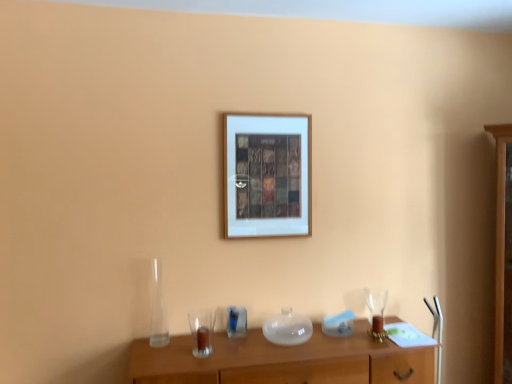
The height and width of the screenshot is (384, 512). What do you see at coordinates (376, 312) in the screenshot?
I see `clear glass wine glass at right` at bounding box center [376, 312].

Measure the distance between point (250, 200) and camera.

The depth of point (250, 200) is 2.47 meters.

Locate an element on the screen. Image resolution: width=512 pixels, height=384 pixels. wooden table at center is located at coordinates (284, 361).

Is clear glass wine glass at right far away from transparent glass vase at lower left?

Yes, clear glass wine glass at right and transparent glass vase at lower left are quite far apart.

From the image's perspective, is clear glass wine glass at right on transparent glass vase at lower left?

Actually, clear glass wine glass at right appears below transparent glass vase at lower left in the image.

Can you tell me how much clear glass wine glass at right and transparent glass vase at lower left differ in facing direction?

clear glass wine glass at right and transparent glass vase at lower left are facing 0.00132 degrees away from each other.

Which of these two, clear glass wine glass at right or transparent glass vase at lower left, is smaller?

With smaller size is clear glass wine glass at right.

The image size is (512, 384). I want to click on wine glass in front of the white matte picture frame at center, so click(376, 312).

Considering the relative sizes of white matte picture frame at center and clear glass wine glass at right in the image provided, is white matte picture frame at center thinner than clear glass wine glass at right?

Yes, white matte picture frame at center is thinner than clear glass wine glass at right.

Is white matte picture frame at center inside or outside of clear glass wine glass at right?

white matte picture frame at center exists outside the volume of clear glass wine glass at right.

Would you say clear glass wine glass at right is a long distance from wooden table at center?

They are positioned close to each other.

Does clear glass wine glass at right have a lesser height compared to wooden table at center?

Yes.

Can we say clear glass wine glass at right lies outside wooden table at center?

Yes, clear glass wine glass at right is located beyond the bounds of wooden table at center.

Between clear glass wine glass at right and white matte picture frame at center, which one has less height?

clear glass wine glass at right.

Considering the relative sizes of clear glass wine glass at right and white matte picture frame at center in the image provided, is clear glass wine glass at right smaller than white matte picture frame at center?

Correct, clear glass wine glass at right occupies less space than white matte picture frame at center.

Is clear glass wine glass at right oriented towards white matte picture frame at center?

No, clear glass wine glass at right is not aimed at white matte picture frame at center.

Between point (379, 334) and point (308, 201), which one is positioned behind?

The point (308, 201) is farther.

Is the surface of transparent glass vase at lower left in direct contact with wooden table at center?

No, transparent glass vase at lower left is not making contact with wooden table at center.

Measure the distance from transparent glass vase at lower left to wooden table at center.

A distance of 20.58 inches exists between transparent glass vase at lower left and wooden table at center.

Is transparent glass vase at lower left oriented towards wooden table at center?

No, transparent glass vase at lower left is not facing towards wooden table at center.

Can you confirm if transparent glass vase at lower left is shorter than wooden table at center?

No, transparent glass vase at lower left is not shorter than wooden table at center.

Considering the relative sizes of white matte picture frame at center and wooden table at center in the image provided, is white matte picture frame at center smaller than wooden table at center?

Yes.

How different are the orientations of white matte picture frame at center and wooden table at center in degrees?

They differ by 0.847 degrees in their facing directions.

Is white matte picture frame at center not near wooden table at center?

No, white matte picture frame at center is not far from wooden table at center.

From their relative heights in the image, would you say white matte picture frame at center is taller or shorter than wooden table at center?

Considering their sizes, white matte picture frame at center has more height than wooden table at center.

Between wooden table at center and transparent glass vase at lower left, which one has less height?

With less height is wooden table at center.

Is wooden table at center looking in the opposite direction of transparent glass vase at lower left?

That's not correct — wooden table at center is not looking away from transparent glass vase at lower left.

How far apart are wooden table at center and transparent glass vase at lower left?

wooden table at center and transparent glass vase at lower left are 20.58 inches apart.

This screenshot has width=512, height=384. In the image, there is a transparent glass vase at lower left. Identify the location of wine glass below it (from a real-world perspective). (376, 312).

The image size is (512, 384). In the image, there is a white matte picture frame at center. Find the location of `wine glass below it (from the image's perspective)`. wine glass below it (from the image's perspective) is located at coordinates (376, 312).

When comparing their distances from transparent glass vase at lower left, does wooden table at center or white matte picture frame at center seem further?

white matte picture frame at center lies further to transparent glass vase at lower left than the other object.

From the image, which object appears to be farther from clear glass wine glass at right, transparent glass vase at lower left or white matte picture frame at center?

transparent glass vase at lower left lies further to clear glass wine glass at right than the other object.

From the image, which object appears to be nearer to clear glass wine glass at right, wooden table at center or transparent glass vase at lower left?

wooden table at center is closer to clear glass wine glass at right.

Estimate the real-world distances between objects in this image. Which object is further from clear glass wine glass at right, white matte picture frame at center or wooden table at center?

Based on the image, white matte picture frame at center appears to be further to clear glass wine glass at right.

When comparing their distances from transparent glass vase at lower left, does white matte picture frame at center or clear glass wine glass at right seem closer?

Based on the image, white matte picture frame at center appears to be nearer to transparent glass vase at lower left.

Estimate the real-world distances between objects in this image. Which object is further from white matte picture frame at center, clear glass wine glass at right or wooden table at center?

clear glass wine glass at right.

From the image, which object appears to be farther from wooden table at center, transparent glass vase at lower left or clear glass wine glass at right?

transparent glass vase at lower left is positioned further to the anchor wooden table at center.

Looking at the image, which one is located closer to wooden table at center, white matte picture frame at center or clear glass wine glass at right?

The object closer to wooden table at center is clear glass wine glass at right.

This screenshot has height=384, width=512. Identify the location of picture frame between transparent glass vase at lower left and clear glass wine glass at right from left to right. (267, 175).

You are a GUI agent. You are given a task and a screenshot of the screen. Output one action in this format:
    pyautogui.click(x=<x>, y=<y>)
    Task: Click on the glass vase between white matte picture frame at center and wooden table at center from top to bottom
    Image resolution: width=512 pixels, height=384 pixels.
    Given the screenshot: What is the action you would take?
    pyautogui.click(x=157, y=307)

This screenshot has width=512, height=384. What are the coordinates of `wine glass between white matte picture frame at center and wooden table at center in the vertical direction` in the screenshot? It's located at (376, 312).

Locate an element on the screen. The height and width of the screenshot is (384, 512). table situated between transparent glass vase at lower left and clear glass wine glass at right from left to right is located at coordinates (284, 361).